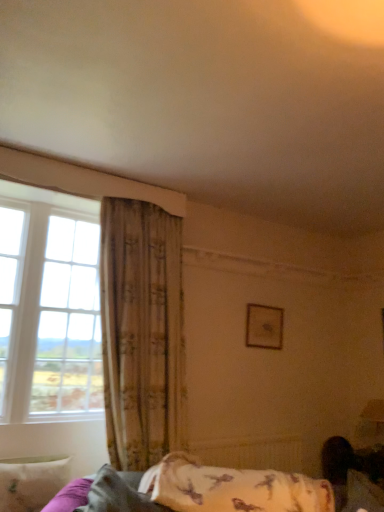
Question: From the image's perspective, is textured beige curtain at left located above clear glass window at left?

Choices:
 (A) no
 (B) yes

Answer: (A)

Question: Is textured beige curtain at left not close to clear glass window at left?

Choices:
 (A) no
 (B) yes

Answer: (A)

Question: Is textured beige curtain at left aimed at clear glass window at left?

Choices:
 (A) no
 (B) yes

Answer: (A)

Question: Is textured beige curtain at left beside clear glass window at left?

Choices:
 (A) no
 (B) yes

Answer: (A)

Question: Is clear glass window at left located within textured beige curtain at left?

Choices:
 (A) yes
 (B) no

Answer: (B)

Question: From their relative heights in the image, would you say fluffy white pillow at lower right, which is counted as the first pillow, starting from the right, is taller or shorter than clear glass window at left?

Choices:
 (A) short
 (B) tall

Answer: (A)

Question: Looking at their shapes, would you say fluffy white pillow at lower right, which is the third pillow in left-to-right order, is wider or thinner than clear glass window at left?

Choices:
 (A) wide
 (B) thin

Answer: (B)

Question: Would you say fluffy white pillow at lower right, which is the third pillow in left-to-right order, is to the left or to the right of clear glass window at left in the picture?

Choices:
 (A) left
 (B) right

Answer: (B)

Question: Would you say fluffy white pillow at lower right, which is counted as the first pillow, starting from the right, is inside or outside clear glass window at left?

Choices:
 (A) outside
 (B) inside

Answer: (A)

Question: Considering the positions of fluffy white pillow at lower right, which is counted as the first pillow, starting from the right, and textured beige curtain at left in the image, is fluffy white pillow at lower right, which is counted as the first pillow, starting from the right, taller or shorter than textured beige curtain at left?

Choices:
 (A) short
 (B) tall

Answer: (A)

Question: Choose the correct answer: Is fluffy white pillow at lower right, which is the third pillow in left-to-right order, inside textured beige curtain at left or outside it?

Choices:
 (A) inside
 (B) outside

Answer: (B)

Question: In the image, is fluffy white pillow at lower right, which is the third pillow in left-to-right order, on the left side or the right side of textured beige curtain at left?

Choices:
 (A) right
 (B) left

Answer: (A)

Question: From a real-world perspective, is fluffy white pillow at lower right, which is counted as the first pillow, starting from the right, above or below textured beige curtain at left?

Choices:
 (A) below
 (B) above

Answer: (A)

Question: Is fluffy white pillow at lower right, which is counted as the first pillow, starting from the right, to the left or to the right of white soft pillow at lower left, which is the 1th pillow in left-to-right order, in the image?

Choices:
 (A) left
 (B) right

Answer: (B)

Question: In terms of size, does fluffy white pillow at lower right, which is the third pillow in left-to-right order, appear bigger or smaller than white soft pillow at lower left, arranged as the third pillow when viewed from the right?

Choices:
 (A) big
 (B) small

Answer: (A)